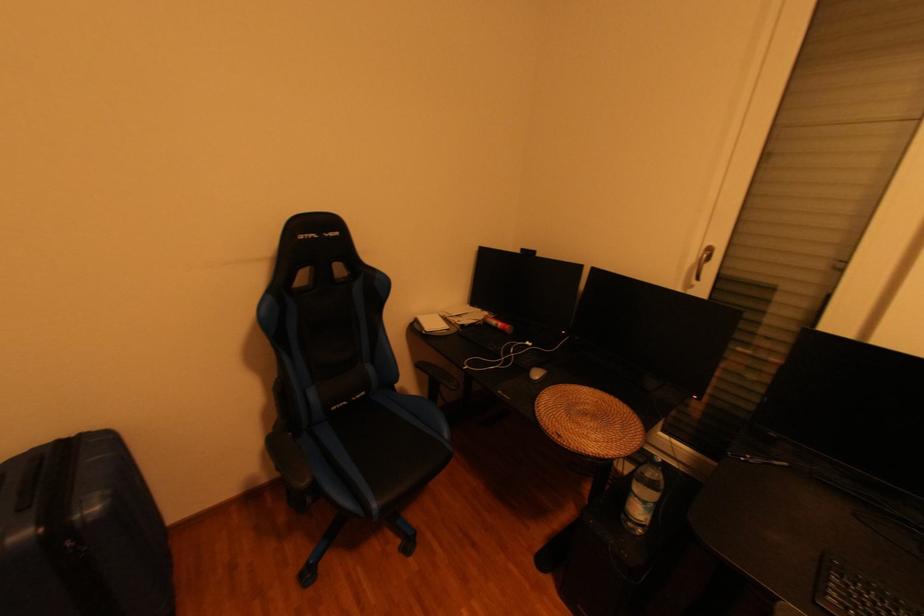
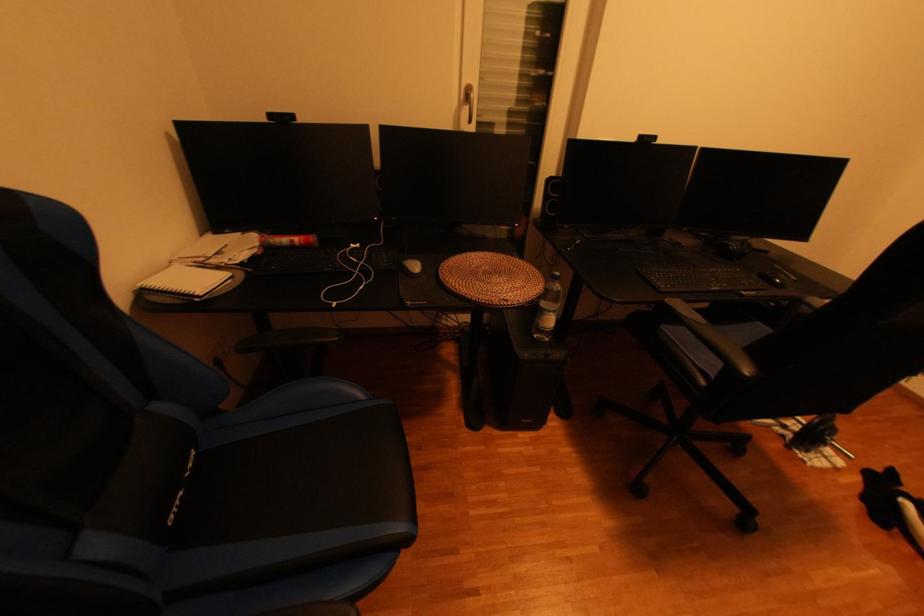
The point at (565, 438) is marked in the first image. Where is the corresponding point in the second image?

(515, 304)